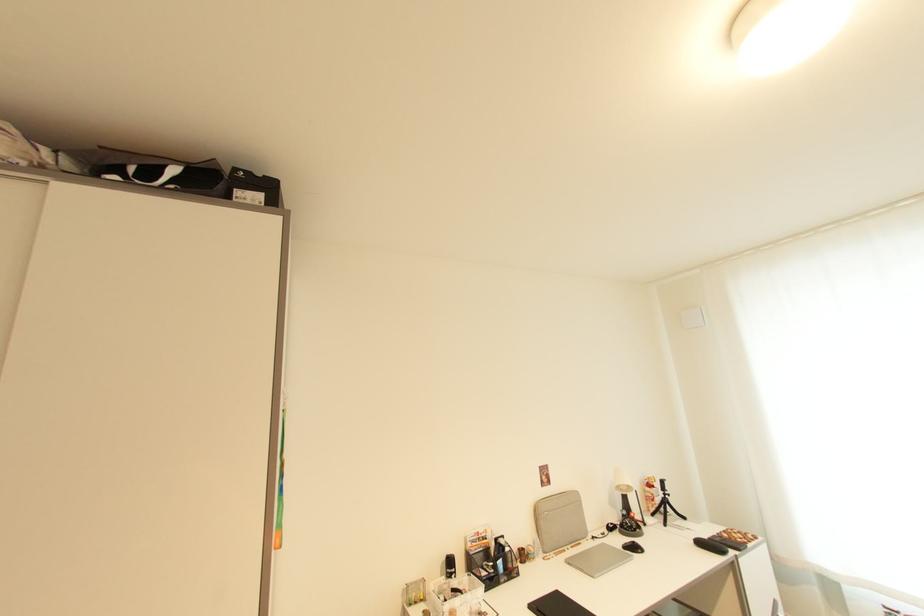
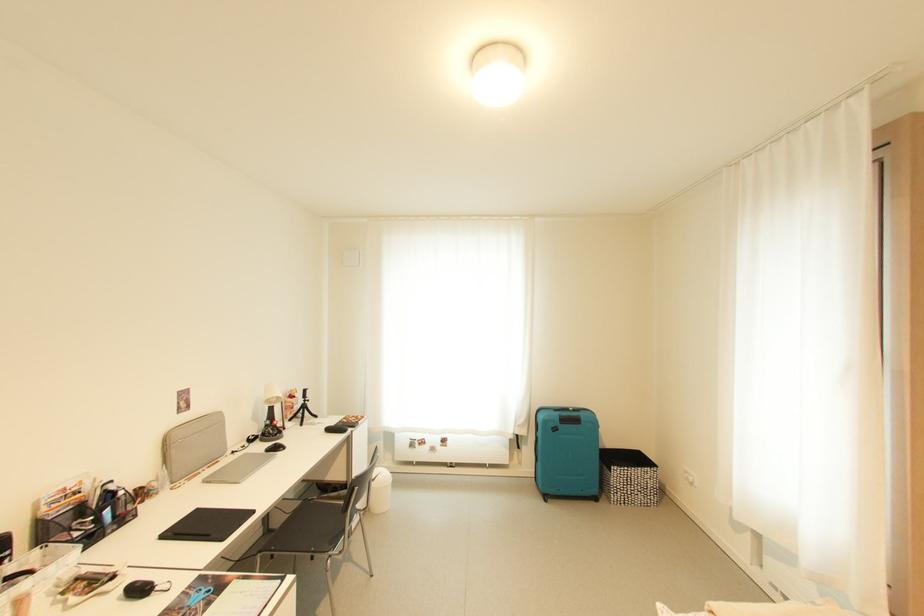
Locate, in the second image, the point that corresponds to (x=658, y=501) in the first image.

(297, 410)